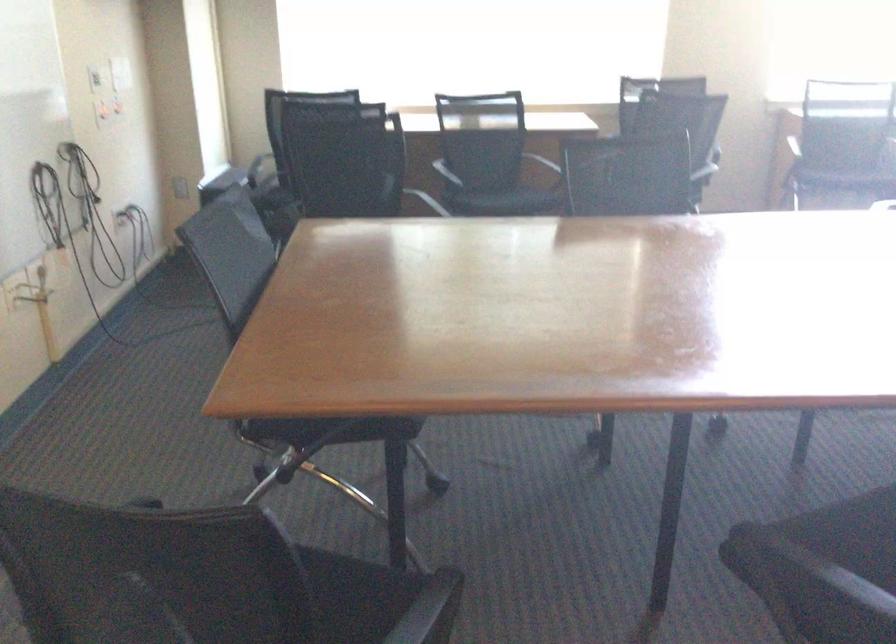
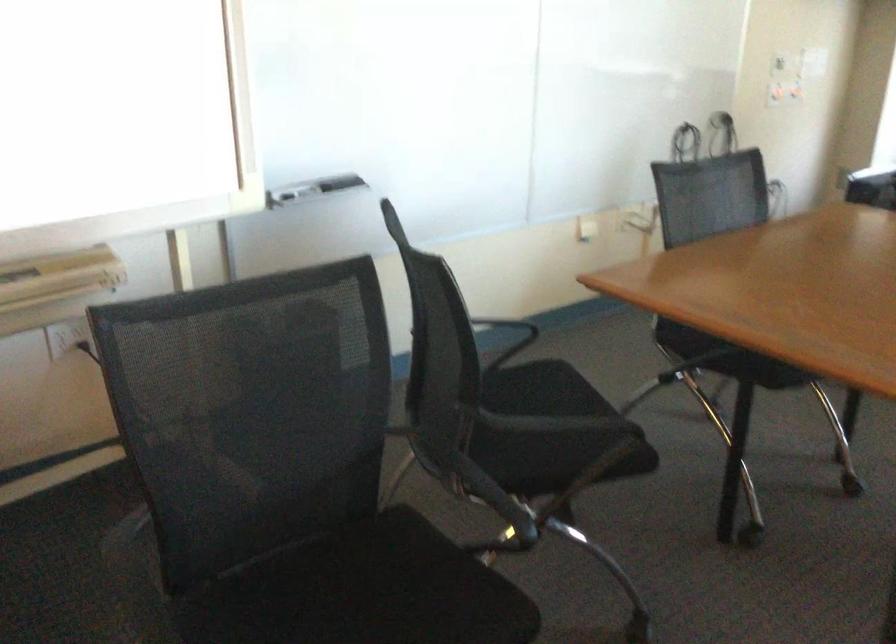
Where in the second image is the point corresponding to (355,431) from the first image?

(728, 357)